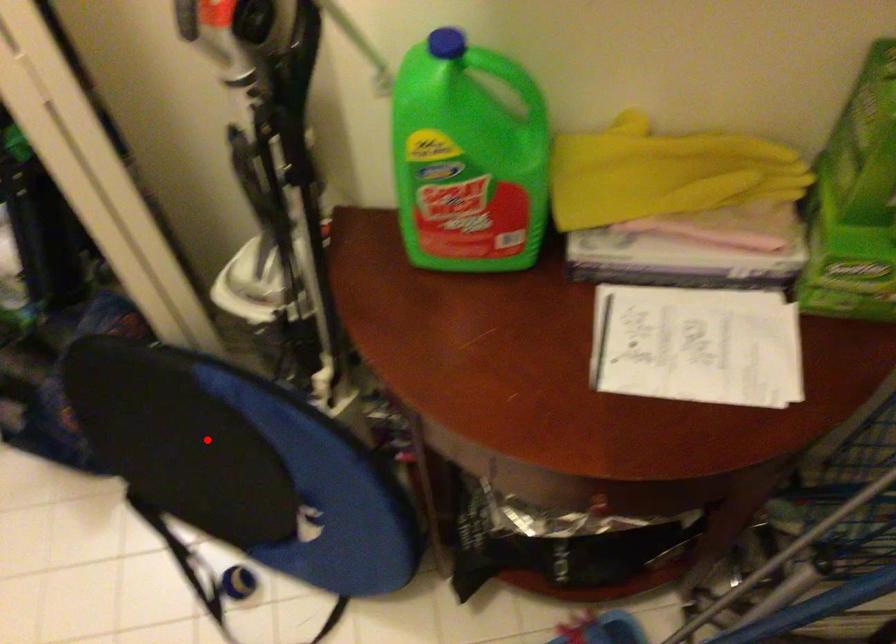
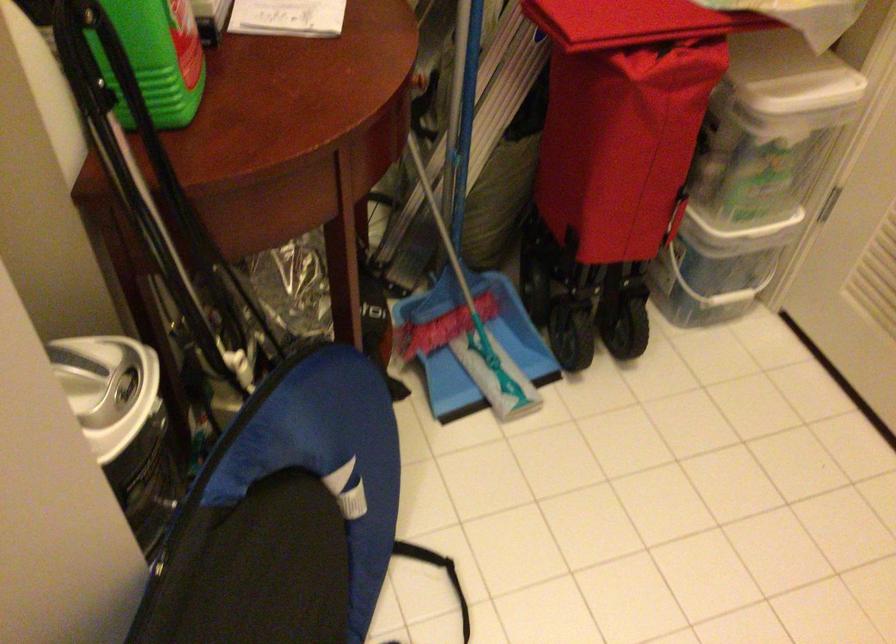
Question: I am providing you with two images of the same scene from different viewpoints. Image1 has a red point marked. In image2, the corresponding 3D location appears at what relative position? Reply with the corresponding letter.

Choices:
 (A) Closer
 (B) Farther

Answer: (A)